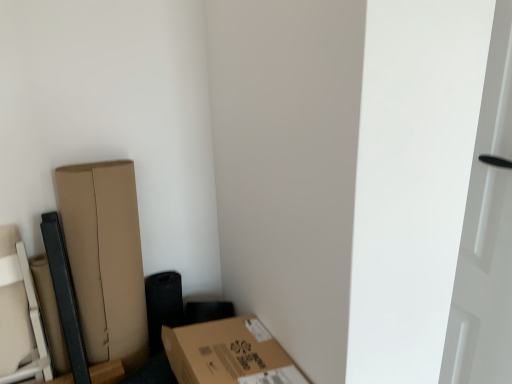
The image size is (512, 384). Describe the element at coordinates (228, 354) in the screenshot. I see `brown cardboard box at lower left` at that location.

What is the approximate width of brown cardboard box at lower left?

brown cardboard box at lower left is 18.19 inches wide.

Measure the distance between point (218,379) and camera.

The depth of point (218,379) is 38.86 inches.

Where is `brown cardboard box at lower left`? brown cardboard box at lower left is located at coordinates (228, 354).

Where is `brown cardboard box at lower left`? This screenshot has height=384, width=512. brown cardboard box at lower left is located at coordinates (228, 354).